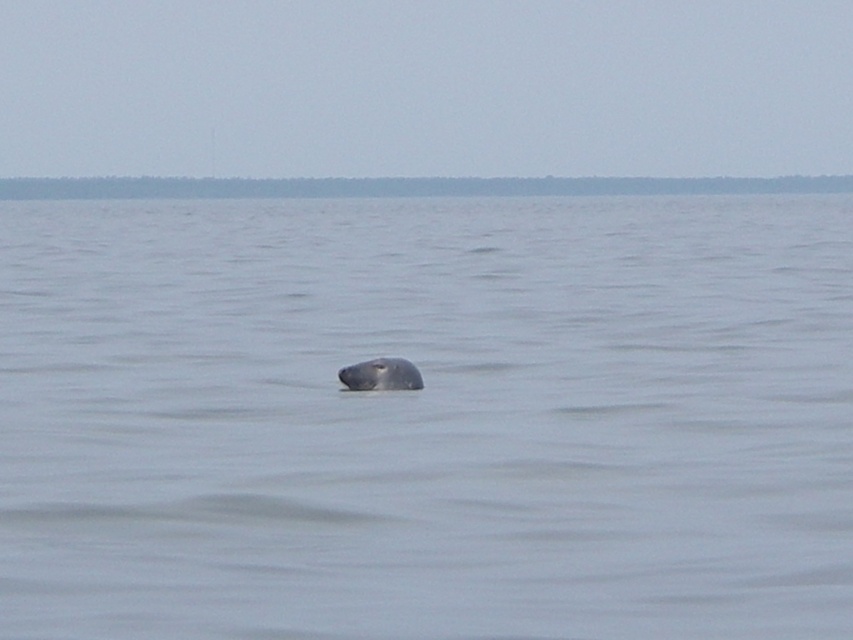
Question: Which object is closer to the camera taking this photo?

Choices:
 (A) gray matte whale at center
 (B) gray matte water at center

Answer: (B)

Question: Does gray matte water at center appear on the left side of gray matte whale at center?

Choices:
 (A) yes
 (B) no

Answer: (A)

Question: From the image, what is the correct spatial relationship of gray matte water at center in relation to gray matte whale at center?

Choices:
 (A) below
 (B) above

Answer: (B)

Question: Does gray matte water at center appear under gray matte whale at center?

Choices:
 (A) no
 (B) yes

Answer: (A)